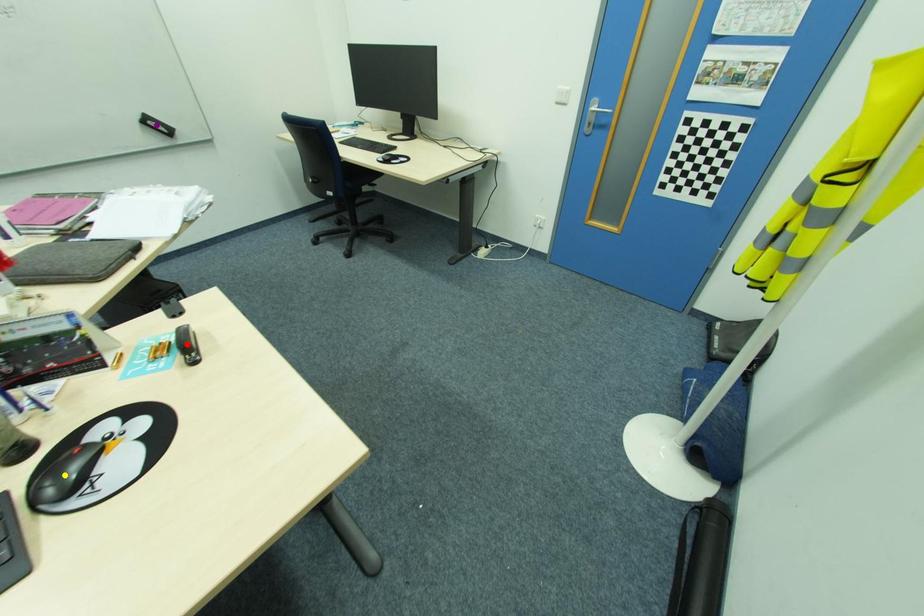
Order these from nearest to farthest:
A) purple point
B) red point
C) yellow point

yellow point → red point → purple point